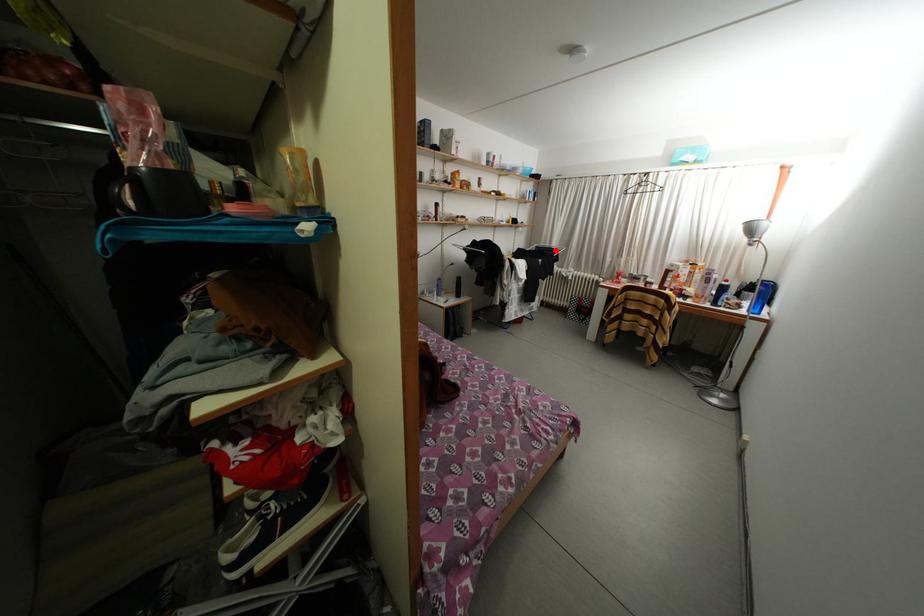
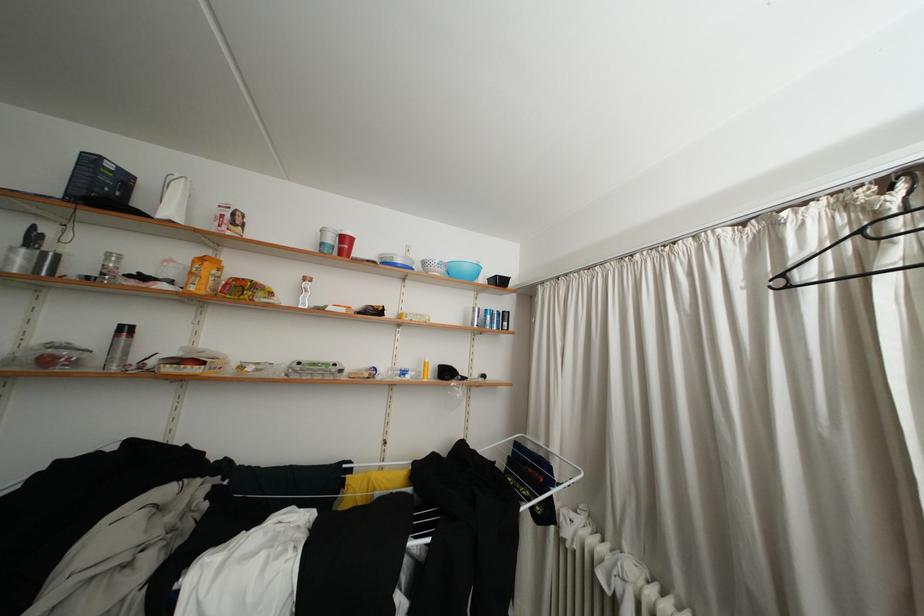
Question: I am providing you with two images of the same scene from different viewpoints. Given a red point in image1, look at the same physical point in image2. Is it:

Choices:
 (A) Closer to the viewpoint
 (B) Farther from the viewpoint

Answer: (B)